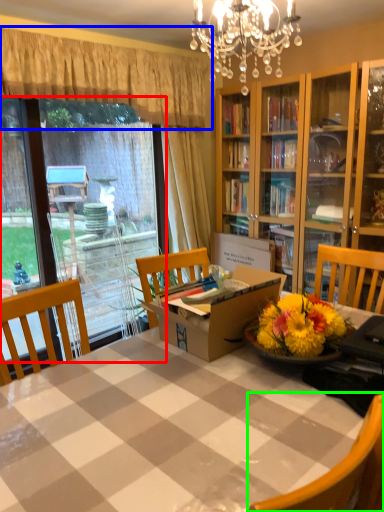
Question: Which object is the closest to the glass door (highlighted by a red box)? Choose among these: curtain (highlighted by a blue box) or chair (highlighted by a green box).

Choices:
 (A) curtain
 (B) chair

Answer: (A)